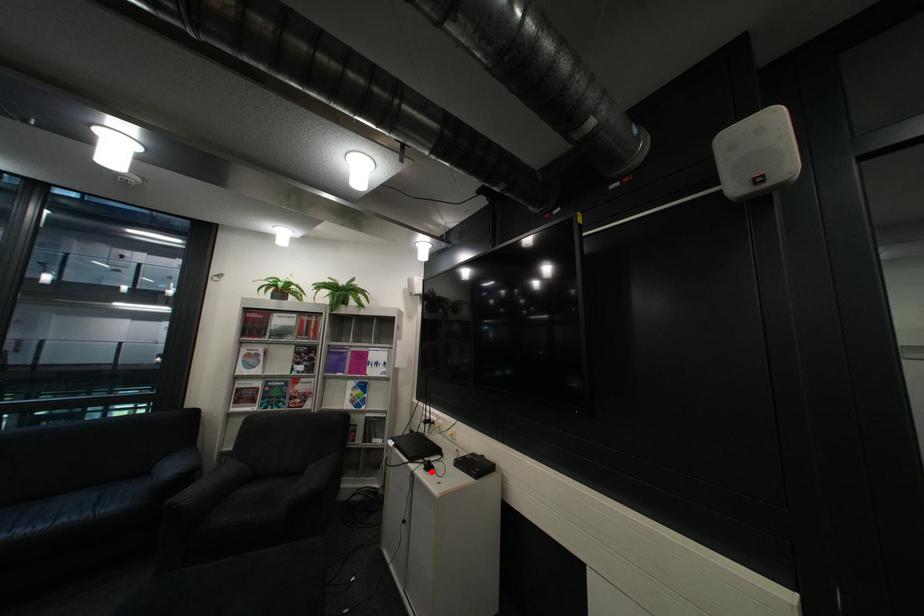
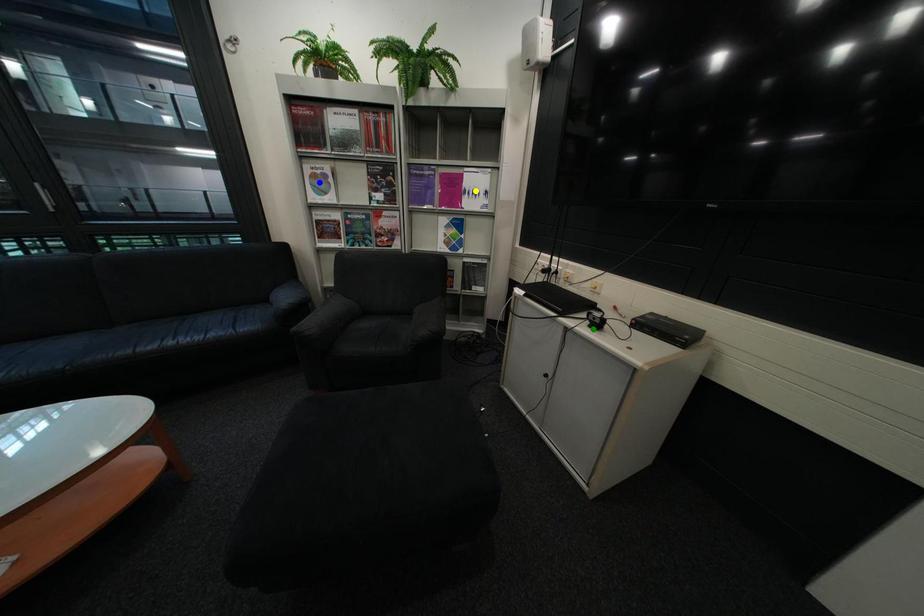
Question: I am providing you with two images of the same scene from different viewpoints. A red point is marked on the first image. You are given multiple points on the second image. Can you choose the point in image 2 that corresponds to the point in image 1?

Choices:
 (A) yellow point
 (B) blue point
 (C) green point

Answer: (C)